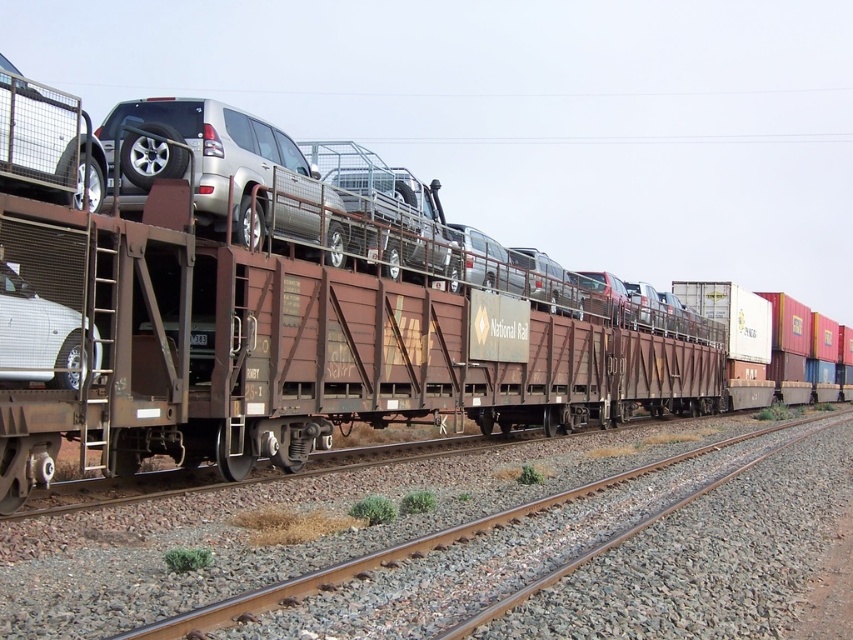
Between satin silver suv at upper center and white matte sedan at left, which one has more height?

satin silver suv at upper center is taller.

Find the location of a particular element. The height and width of the screenshot is (640, 853). satin silver suv at upper center is located at coordinates (200, 157).

The height and width of the screenshot is (640, 853). Describe the element at coordinates (200, 157) in the screenshot. I see `satin silver suv at upper center` at that location.

At what (x,y) coordinates should I click in order to perform the action: click on satin silver suv at upper center. Please return your answer as a coordinate pair (x, y). This screenshot has height=640, width=853. Looking at the image, I should click on (200, 157).

Is satin silver suv at upper center taller than brown metal train track at center?

Yes, satin silver suv at upper center is taller than brown metal train track at center.

Does point (154, 148) come behind point (300, 582)?

Yes, point (154, 148) is behind point (300, 582).

Does point (219, 161) come farther from viewer compared to point (643, 468)?

No, (219, 161) is closer to viewer.

Locate an element on the screen. satin silver suv at upper center is located at coordinates (200, 157).

Does rusty metal train car at center have a smaller size compared to brown metal train track at center?

No, rusty metal train car at center is not smaller than brown metal train track at center.

Can you confirm if rusty metal train car at center is thinner than brown metal train track at center?

In fact, rusty metal train car at center might be wider than brown metal train track at center.

Locate an element on the screen. rusty metal train car at center is located at coordinates (280, 317).